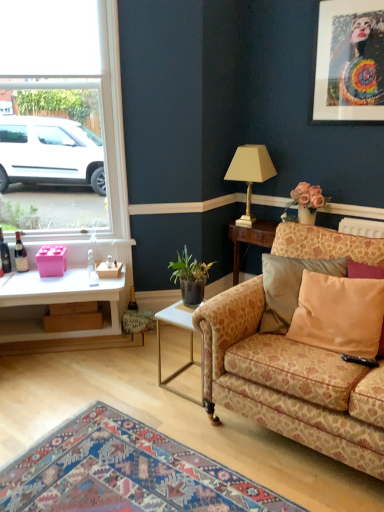
Image resolution: width=384 pixels, height=512 pixels. I want to click on vacant area that lies between white metal side table at lower center and brown cardboard box at lower left, the 1th box from the bottom, so click(126, 356).